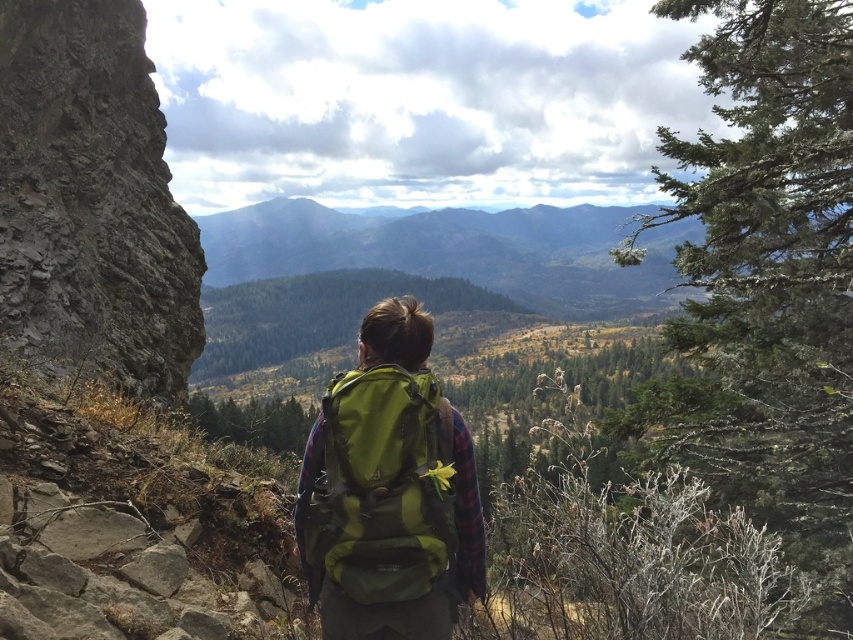
From the picture: Can you confirm if gray rough rock at left is smaller than green fabric backpack at center?

No, gray rough rock at left is not smaller than green fabric backpack at center.

Is gray rough rock at left wider than green fabric backpack at center?

Yes, gray rough rock at left is wider than green fabric backpack at center.

Is point (146, 227) positioned behind point (351, 436)?

Yes, point (146, 227) is behind point (351, 436).

At what (x,y) coordinates should I click in order to perform the action: click on gray rough rock at left. Please return your answer as a coordinate pair (x, y). Looking at the image, I should click on (91, 198).